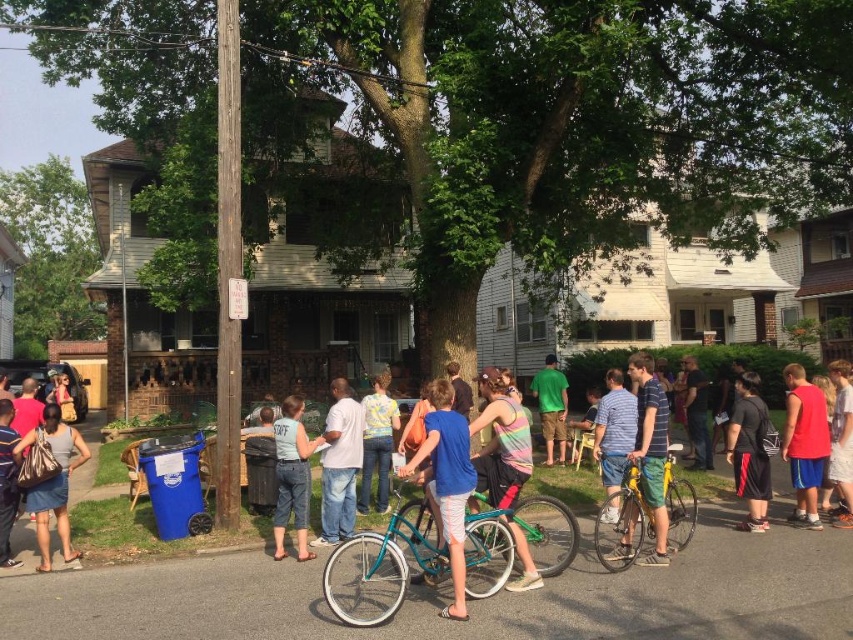
Does yellow-green shorts at center have a greater height compared to matte black shirt at lower left?

No, yellow-green shorts at center is not taller than matte black shirt at lower left.

Where is `yellow-green shorts at center`? This screenshot has height=640, width=853. yellow-green shorts at center is located at coordinates (613, 440).

I want to click on yellow-green shorts at center, so coord(613,440).

Does yellow-green shorts at center have a greater height compared to denim jeans at center?

No.

Who is more forward, (614, 460) or (381, 435)?

Point (614, 460)

Is point (607, 497) less distant than point (379, 400)?

Yes, point (607, 497) is in front of point (379, 400).

You are a GUI agent. You are given a task and a screenshot of the screen. Output one action in this format:
    pyautogui.click(x=<x>, y=<y>)
    Task: Click on the yellow-green shorts at center
    This screenshot has height=640, width=853.
    Given the screenshot: What is the action you would take?
    pyautogui.click(x=613, y=440)

Does black cotton shirt at right have a larger size compared to red t-shirt at right?

Indeed, black cotton shirt at right has a larger size compared to red t-shirt at right.

Between black cotton shirt at right and red t-shirt at right, which one has less height?

red t-shirt at right

Between point (741, 448) and point (842, 518), which one is positioned in front?

Point (741, 448) is in front.

At what (x,y) coordinates should I click in order to perform the action: click on black cotton shirt at right. Please return your answer as a coordinate pair (x, y). The image size is (853, 640). Looking at the image, I should click on [x=749, y=451].